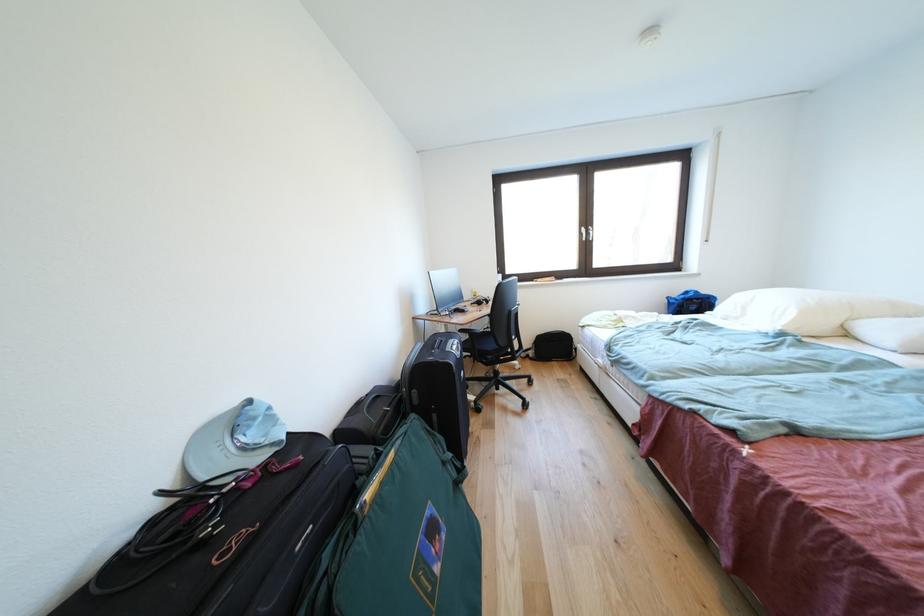
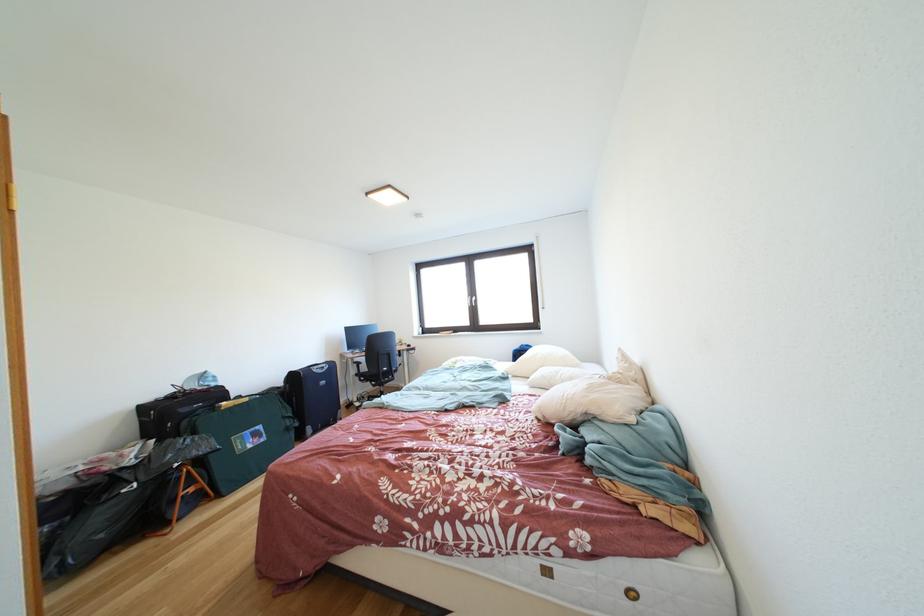
In the second image, find the point that corresponds to the point at 706,297 in the first image.

(535, 351)